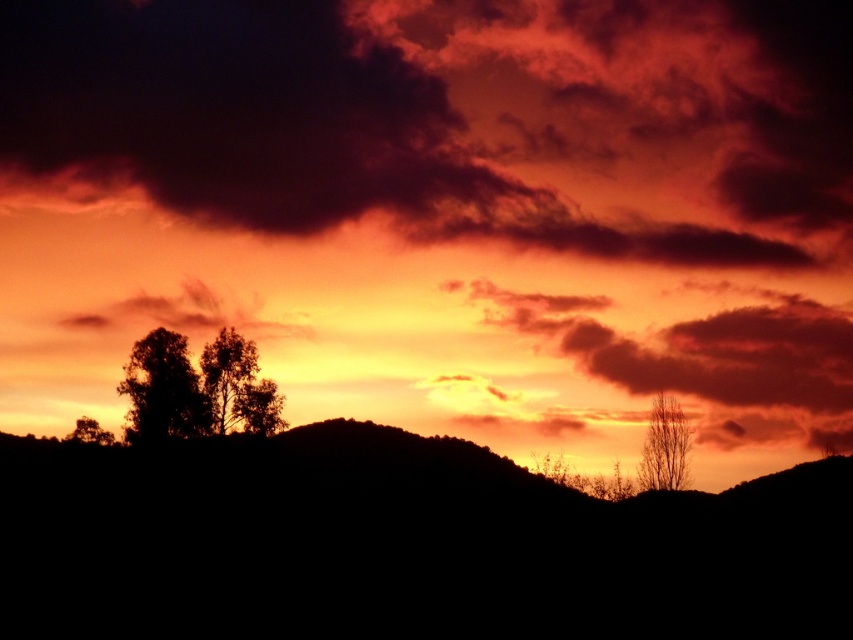
Can you confirm if green leafy tree at center is positioned to the left of bare branches at right?

Correct, you'll find green leafy tree at center to the left of bare branches at right.

The height and width of the screenshot is (640, 853). What are the coordinates of `green leafy tree at center` in the screenshot? It's located at (238, 387).

Consider the image. Who is positioned more to the left, dark green leafy tree at left or green leafy tree at center?

From the viewer's perspective, dark green leafy tree at left appears more on the left side.

Between dark green leafy tree at left and green leafy tree at center, which one is positioned higher?

green leafy tree at center

Is point (137, 413) closer to viewer compared to point (263, 420)?

Yes, point (137, 413) is closer to viewer.

This screenshot has width=853, height=640. What are the coordinates of `dark green leafy tree at left` in the screenshot? It's located at (163, 390).

Does silhouette hillside at center have a larger size compared to silhouette tree at left?

Yes.

Is point (105, 602) positioned before point (99, 435)?

That is True.

You are a GUI agent. You are given a task and a screenshot of the screen. Output one action in this format:
    pyautogui.click(x=<x>, y=<y>)
    Task: Click on the silhouette hillside at center
    This screenshot has height=640, width=853.
    Given the screenshot: What is the action you would take?
    pyautogui.click(x=403, y=545)